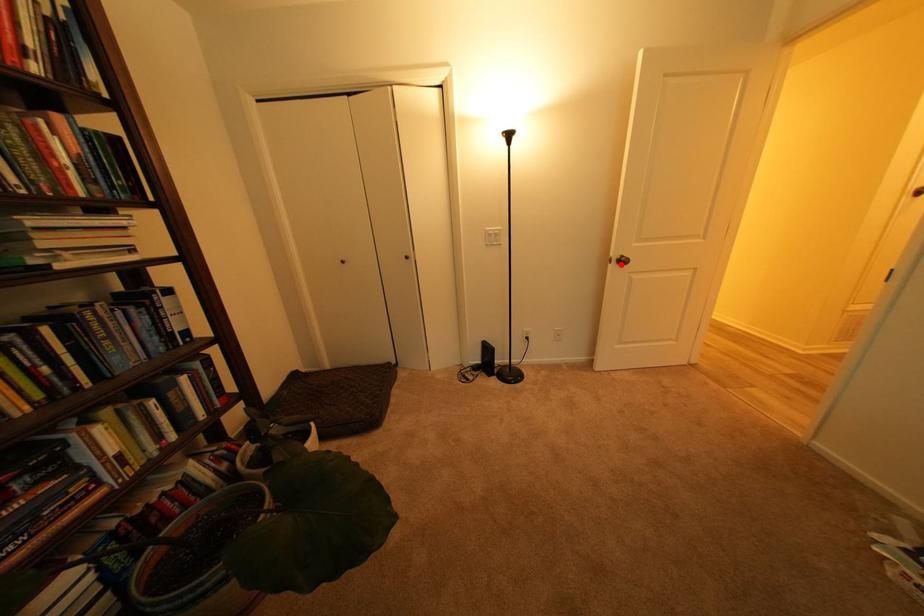
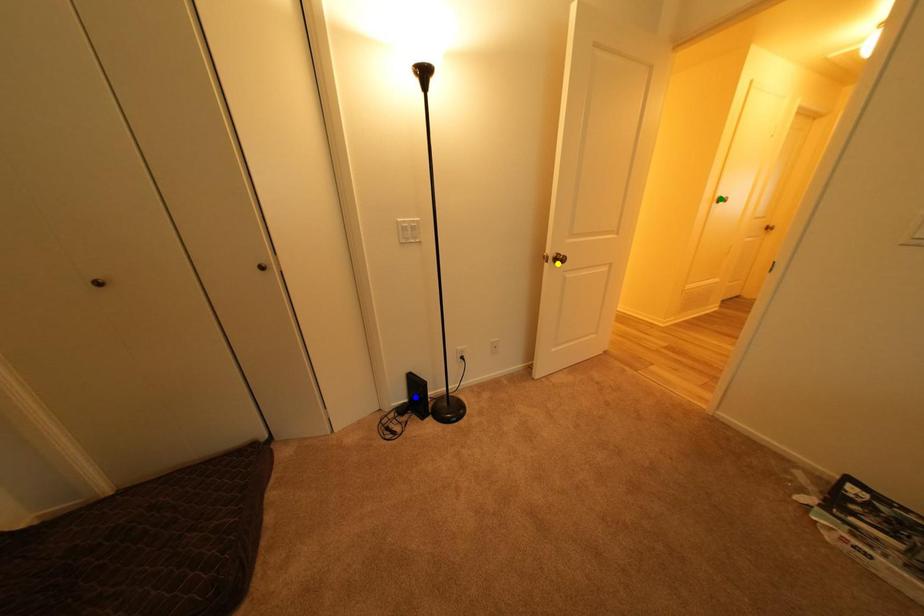
Question: I am providing you with two images of the same scene from different viewpoints. A red point is marked on the first image. You are given multiple points on the second image. Which point in image 2 is actually the same real-world point as the red point in image 1?

Choices:
 (A) green point
 (B) yellow point
 (C) blue point

Answer: (B)